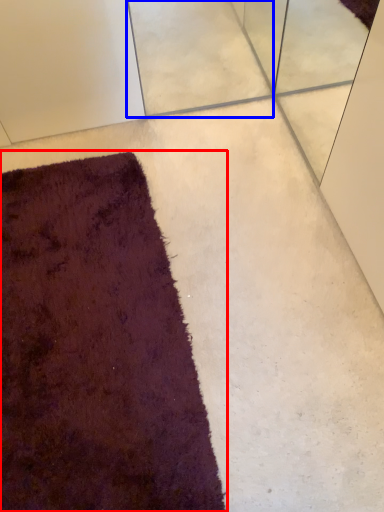
Question: Which of the following is the farthest to the observer, towel (highlighted by a red box) or concrete (highlighted by a blue box)?

Choices:
 (A) towel
 (B) concrete

Answer: (B)